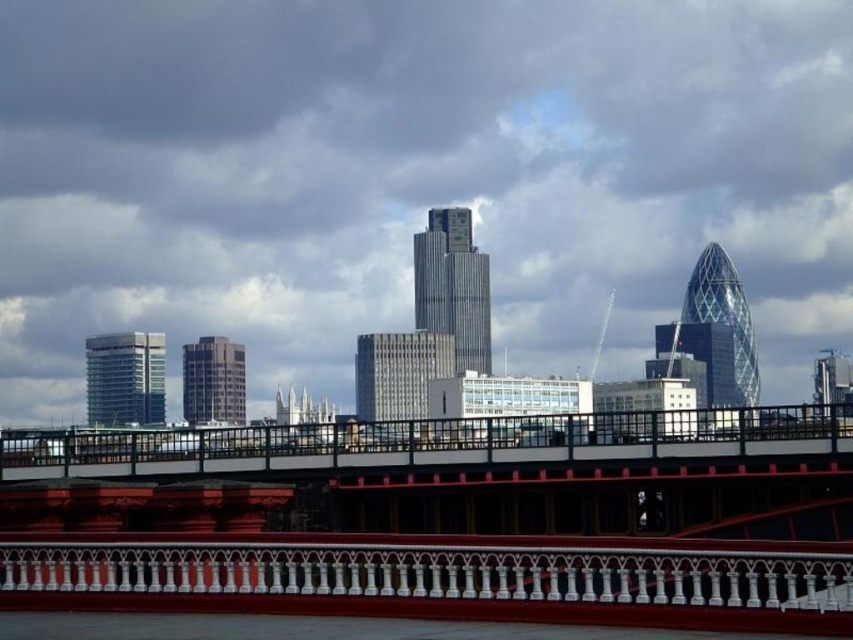
You are a tourist standing on the riverbank and see both the transparent glass bridge at center and the metallic red pedestrian bridge at center. Which bridge is closer to the left side from your perspective?

The transparent glass bridge at center is closer to the left side from your perspective because it is positioned to the left of the metallic red pedestrian bridge at center.

You are a drone operator who needs to fly a drone from the transparent glass bridge at center to a point directly above the river. Given the coordinates of the bridge, can you determine the direction you should fly the drone to reach the river?

The transparent glass bridge at center is located at coordinates point [413,179]. To fly the drone to the river, you would need to move it in the direction towards the lower part of the image since the river is in the foreground below the bridge.

You are standing on the transparent glass bridge at center and want to cross to the metallic red pedestrian bridge at center. Which bridge is closer to you?

The transparent glass bridge at center is the one you are currently standing on, so it is directly under your feet. The metallic red pedestrian bridge at center is farther away from you since it is positioned behind the transparent glass bridge at center according to their spatial relationship.